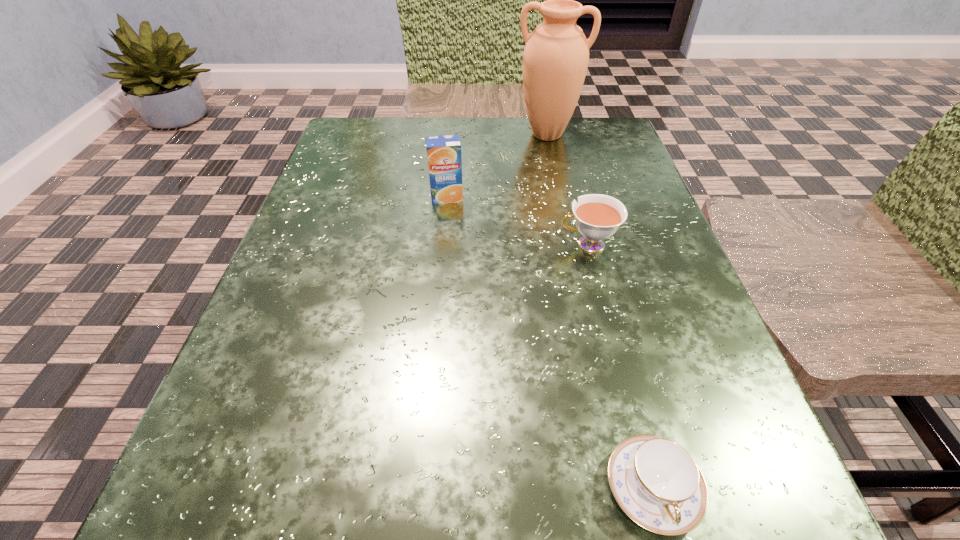
In the image, there is a desktop. Where is `vacant space at the far right corner`? This screenshot has width=960, height=540. vacant space at the far right corner is located at coordinates (563, 143).

I want to click on vacant region between the urn and the taller teacup, so click(567, 190).

Where is `free spot between the taller teacup and the orange_juice`? Image resolution: width=960 pixels, height=540 pixels. free spot between the taller teacup and the orange_juice is located at coordinates (517, 221).

This screenshot has height=540, width=960. I want to click on vacant point located between the tallest object and the third shortest object, so click(x=496, y=166).

The width and height of the screenshot is (960, 540). In order to click on the second closest object to the taller teacup in this screenshot , I will do `click(556, 55)`.

Identify which object is the second nearest to the leftmost object. Please provide its 2D coordinates. Your answer should be formatted as a tuple, i.e. [(x, y)], where the tuple contains the x and y coordinates of a point satisfying the conditions above.

[(556, 55)]